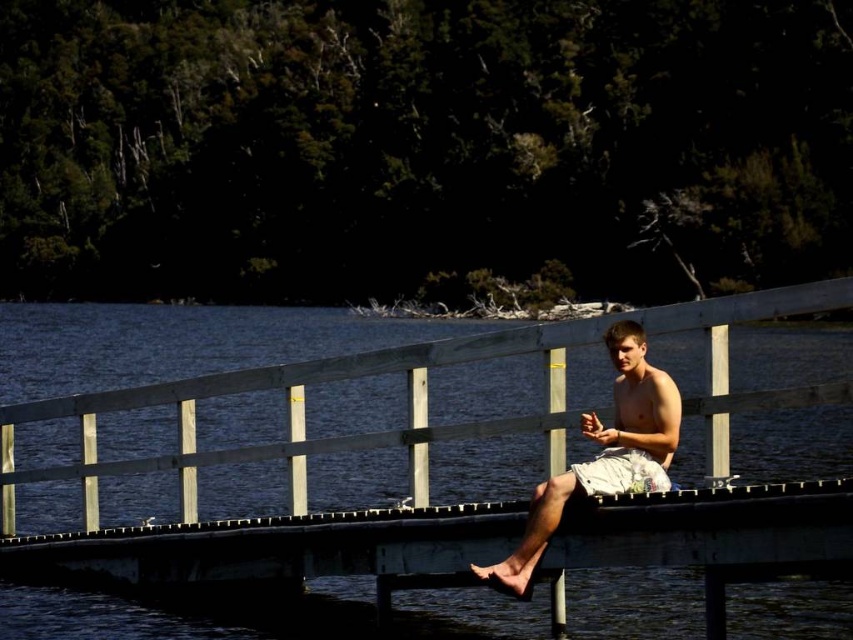
The width and height of the screenshot is (853, 640). What do you see at coordinates (314, 444) in the screenshot? I see `blue water at center` at bounding box center [314, 444].

Image resolution: width=853 pixels, height=640 pixels. In order to click on blue water at center in this screenshot , I will do `click(314, 444)`.

Does light beige shorts at center have a greater width compared to white cotton shorts at center?

Indeed, light beige shorts at center has a greater width compared to white cotton shorts at center.

Is light beige shorts at center positioned in front of white cotton shorts at center?

Yes.

Where is `light beige shorts at center`? Image resolution: width=853 pixels, height=640 pixels. light beige shorts at center is located at coordinates (602, 454).

Who is higher up, white painted wood dock at center or white cotton shorts at center?

white cotton shorts at center

Between point (148, 557) and point (665, 484), which one is positioned behind?

Point (148, 557)

Identify the location of white painted wood dock at center. (277, 552).